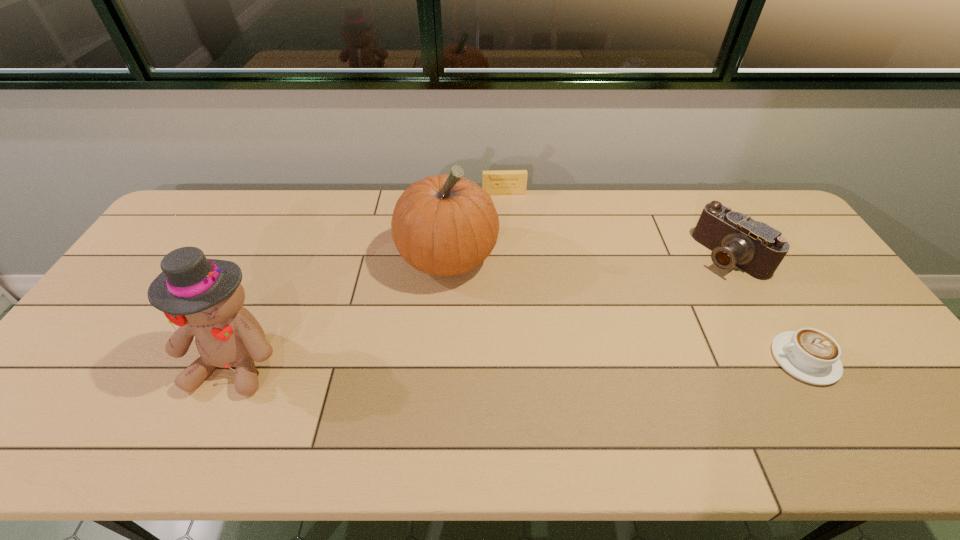
Where is `vacant space on the desktop that is between the leftmost object and the cappuccino and is positioned on the stem of the pumpkin`? Image resolution: width=960 pixels, height=540 pixels. vacant space on the desktop that is between the leftmost object and the cappuccino and is positioned on the stem of the pumpkin is located at coordinates (521, 360).

Identify the location of vacant spot on the desktop that is between the rag_doll and the shortest object and is positioned at the front of the farthest object with spools. (524, 360).

Find the location of a particular element. Image resolution: width=960 pixels, height=540 pixels. free space on the desktop that is between the leftmost object and the shortest object and is positioned on the front-facing side of the third tallest object is located at coordinates (570, 360).